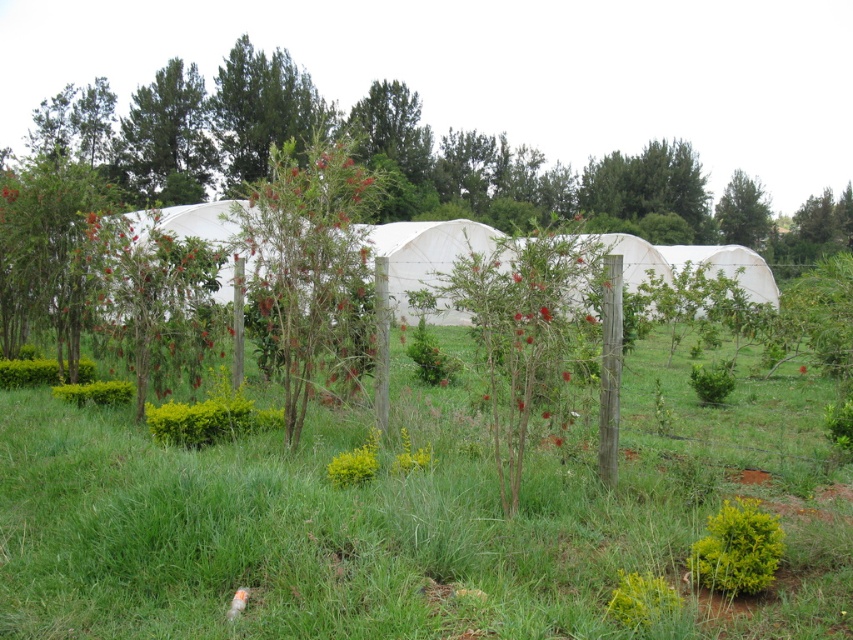
You are standing at the wooden fence in the foreground of the rural scene. You spot two points marked in the image. One is at point (260, 76) and the other at point (120, 177). Which point is closer to you?

Point (120, 177) is closer to you because it is in front of point (260, 76).

You are standing in the middle of the grassy area in front of the greenhouse structures. You notice two green matte trees in the upper part of the scene. Which of these trees is nearer to you, the green matte tree at upper center or the green matte tree at upper left?

The green matte tree at upper center is closer to the viewer than the green matte tree at upper left, so it is nearer to you.